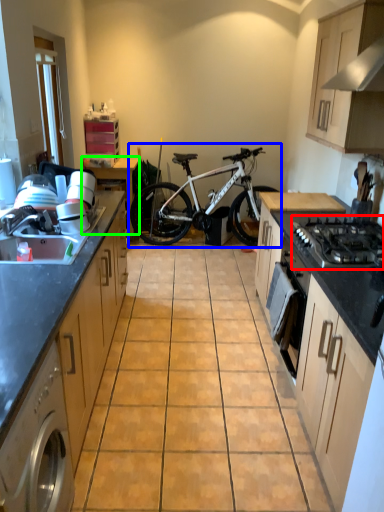
Question: Estimate the real-world distances between objects in this image. Which object is closer to gas stove (highlighted by a red box), bicycle (highlighted by a blue box) or table (highlighted by a green box)?

Choices:
 (A) bicycle
 (B) table

Answer: (A)